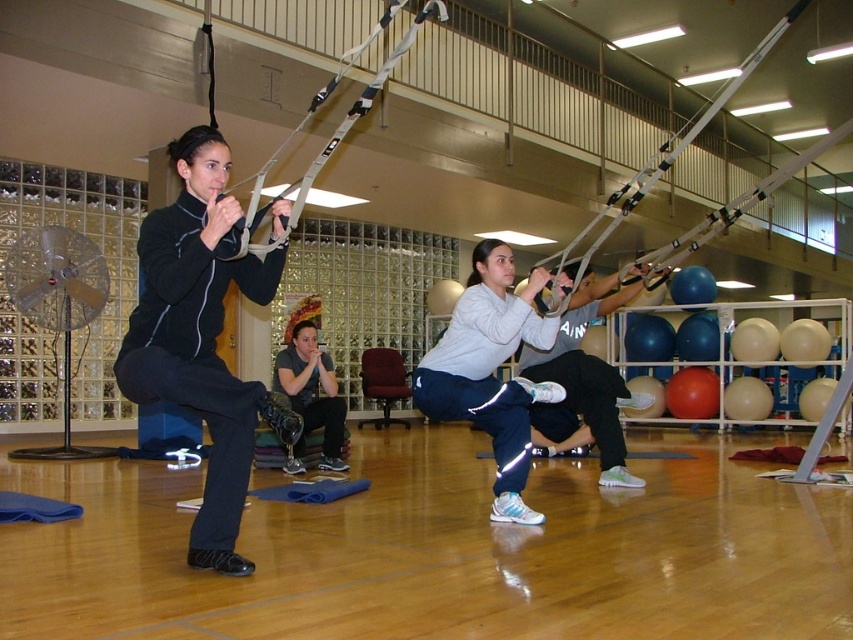
You are a physical therapist observing the group fitness class. You need to ensure that the participants have enough space to safely perform their exercises. Given that the recommended minimum distance between participants is 2 meters for safety, can the white matte athletic pants at center and the matte black prosthetic leg at center maintain a safe distance?

The distance between the white matte athletic pants at center and the matte black prosthetic leg at center is 1.95 meters, which is slightly less than the recommended 2 meters. Therefore, they are not maintaining a safe distance.

You are a photographer setting up for a fitness class photo shoot. You need to ensure that the white matte athletic pants at center and the matte black prosthetic leg at center are both clearly visible in the shot. Based on their positions, which object should you focus on first to ensure both are in focus?

The white matte athletic pants at center is in front of the matte black prosthetic leg at center, so focusing on the white matte athletic pants at center first will ensure both are in focus since it is closer to the camera.